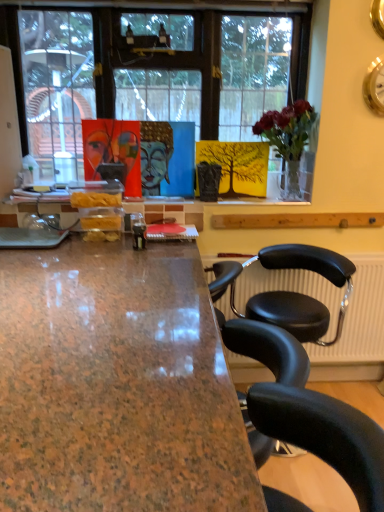
In order to click on brown polished granite desk at center in this screenshot , I will do `click(116, 384)`.

Image resolution: width=384 pixels, height=512 pixels. What do you see at coordinates (300, 293) in the screenshot? I see `black leather chair at right` at bounding box center [300, 293].

The width and height of the screenshot is (384, 512). What do you see at coordinates (155, 155) in the screenshot?
I see `blue glossy buddha head at center` at bounding box center [155, 155].

You are a GUI agent. You are given a task and a screenshot of the screen. Output one action in this format:
    pyautogui.click(x=<x>, y=<y>)
    Task: Click on the brown polished granite desk at center
    
    Given the screenshot: What is the action you would take?
    pyautogui.click(x=116, y=384)

Considering the relative sizes of black leather chair at right and blue glossy buddha head at center in the image provided, is black leather chair at right taller than blue glossy buddha head at center?

Correct, black leather chair at right is much taller as blue glossy buddha head at center.

Is black leather chair at right facing away from blue glossy buddha head at center?

No, black leather chair at right is not facing the opposite direction of blue glossy buddha head at center.

Considering the relative sizes of black leather chair at right and blue glossy buddha head at center in the image provided, is black leather chair at right bigger than blue glossy buddha head at center?

Yes.

From the image's perspective, which one is positioned higher, black leather chair at right or brown polished granite desk at center?

From the image's view, black leather chair at right is above.

What's the angular difference between black leather chair at right and brown polished granite desk at center's facing directions?

black leather chair at right and brown polished granite desk at center are facing 88.2 degrees away from each other.

Considering the sizes of objects black leather chair at right and brown polished granite desk at center in the image provided, who is bigger, black leather chair at right or brown polished granite desk at center?

Bigger between the two is brown polished granite desk at center.

Considering their positions, is blue glossy buddha head at center located in front of or behind matte acrylic painting of a human face at upper center?

blue glossy buddha head at center is behind matte acrylic painting of a human face at upper center.

Does blue glossy buddha head at center appear on the right side of matte acrylic painting of a human face at upper center?

Correct, you'll find blue glossy buddha head at center to the right of matte acrylic painting of a human face at upper center.

In the image, there is a matte acrylic painting of a human face at upper center. Find the location of `person above it (from the image's perspective)`. person above it (from the image's perspective) is located at coordinates (155, 155).

From the image's perspective, which object appears higher, blue glossy buddha head at center or matte acrylic painting of a human face at upper center?

blue glossy buddha head at center appears higher in the image.

Does matte acrylic painting of a human face at upper center have a smaller size compared to brown polished granite desk at center?

Yes.

Is matte acrylic painting of a human face at upper center beside brown polished granite desk at center?

No, matte acrylic painting of a human face at upper center is not in contact with brown polished granite desk at center.

From a real-world perspective, which is physically above, matte acrylic painting of a human face at upper center or brown polished granite desk at center?

From a 3D spatial view, matte acrylic painting of a human face at upper center is above.

Could you measure the distance between matte acrylic painting of a human face at upper center and brown polished granite desk at center?

matte acrylic painting of a human face at upper center is 1.13 meters away from brown polished granite desk at center.

Is blue glossy buddha head at center completely or partially outside of brown polished granite desk at center?

blue glossy buddha head at center lies outside brown polished granite desk at center's area.

Considering the relative sizes of blue glossy buddha head at center and brown polished granite desk at center in the image provided, is blue glossy buddha head at center bigger than brown polished granite desk at center?

Incorrect, blue glossy buddha head at center is not larger than brown polished granite desk at center.

Who is more distant, blue glossy buddha head at center or brown polished granite desk at center?

Positioned behind is blue glossy buddha head at center.

In order to click on person above the brown polished granite desk at center (from a real-world perspective) in this screenshot , I will do `click(155, 155)`.

What are the coordinates of `human face located behind the black leather chair at right` in the screenshot? It's located at (111, 149).

Is black leather chair at right to the left or to the right of matte acrylic painting of a human face at upper center in the image?

From the image, it's evident that black leather chair at right is to the right of matte acrylic painting of a human face at upper center.

How different are the orientations of black leather chair at right and matte acrylic painting of a human face at upper center in degrees?

2.14 degrees separate the facing orientations of black leather chair at right and matte acrylic painting of a human face at upper center.

Is brown polished granite desk at center in contact with black leather chair at right?

brown polished granite desk at center is not next to black leather chair at right, and they're not touching.

Which is correct: brown polished granite desk at center is inside black leather chair at right, or outside of it?

brown polished granite desk at center lies outside black leather chair at right.

From a real-world perspective, is brown polished granite desk at center located beneath black leather chair at right?

Yes, from a real-world perspective, brown polished granite desk at center is under black leather chair at right.

You are a GUI agent. You are given a task and a screenshot of the screen. Output one action in this format:
    pyautogui.click(x=<x>, y=<y>)
    Task: Click on the chair below the blue glossy buddha head at center (from a real-world perspective)
    This screenshot has width=384, height=512.
    Given the screenshot: What is the action you would take?
    pyautogui.click(x=300, y=293)

You are a GUI agent. You are given a task and a screenshot of the screen. Output one action in this format:
    pyautogui.click(x=<x>, y=<y>)
    Task: Click on the chair lying behind the brown polished granite desk at center
    This screenshot has width=384, height=512.
    Given the screenshot: What is the action you would take?
    pyautogui.click(x=300, y=293)

Which object lies further to the anchor point blue glossy buddha head at center, matte acrylic painting of a human face at upper center or brown polished granite desk at center?

brown polished granite desk at center is further to blue glossy buddha head at center.

Which object lies nearer to the anchor point matte acrylic painting of a human face at upper center, blue glossy buddha head at center or brown polished granite desk at center?

The object closer to matte acrylic painting of a human face at upper center is blue glossy buddha head at center.

Which object lies further to the anchor point brown polished granite desk at center, black leather chair at right or blue glossy buddha head at center?

blue glossy buddha head at center is positioned further to the anchor brown polished granite desk at center.

Estimate the real-world distances between objects in this image. Which object is further from matte acrylic painting of a human face at upper center, black leather chair at right or brown polished granite desk at center?

Among the two, brown polished granite desk at center is located further to matte acrylic painting of a human face at upper center.

When comparing their distances from brown polished granite desk at center, does matte acrylic painting of a human face at upper center or blue glossy buddha head at center seem further?

matte acrylic painting of a human face at upper center is positioned further to the anchor brown polished granite desk at center.

Which object lies further to the anchor point black leather chair at right, blue glossy buddha head at center or matte acrylic painting of a human face at upper center?

matte acrylic painting of a human face at upper center lies further to black leather chair at right than the other object.

Considering their positions, is blue glossy buddha head at center positioned closer to brown polished granite desk at center than black leather chair at right?

black leather chair at right lies closer to brown polished granite desk at center than the other object.

Estimate the real-world distances between objects in this image. Which object is further from black leather chair at right, brown polished granite desk at center or blue glossy buddha head at center?

Among the two, blue glossy buddha head at center is located further to black leather chair at right.

Locate an element on the screen. The height and width of the screenshot is (512, 384). person between matte acrylic painting of a human face at upper center and black leather chair at right is located at coordinates (155, 155).

You are a GUI agent. You are given a task and a screenshot of the screen. Output one action in this format:
    pyautogui.click(x=<x>, y=<y>)
    Task: Click on the human face between brown polished granite desk at center and blue glossy buddha head at center from front to back
    Image resolution: width=384 pixels, height=512 pixels.
    Given the screenshot: What is the action you would take?
    pyautogui.click(x=111, y=149)

Where is `chair between brown polished granite desk at center and blue glossy buddha head at center in the front-back direction`? The image size is (384, 512). chair between brown polished granite desk at center and blue glossy buddha head at center in the front-back direction is located at coordinates (300, 293).

What are the coordinates of `chair between brown polished granite desk at center and matte acrylic painting of a human face at upper center from front to back` in the screenshot? It's located at (300, 293).